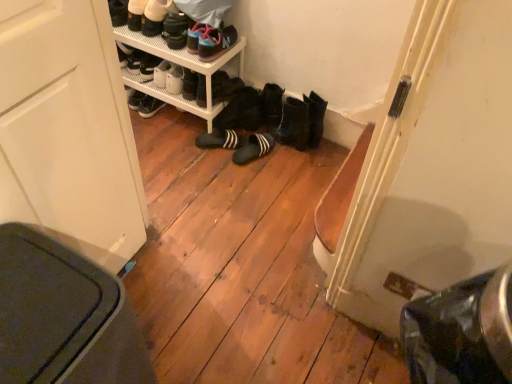
Question: In which direction should I rotate to look at black suede slippers at center, arranged as the 7th footwear when viewed from the top?

Choices:
 (A) left
 (B) right

Answer: (A)

Question: Considering the relative positions of white leather shoes at upper left, which is counted as the seventh footwear, starting from the bottom, and white plastic shelf at upper center in the image provided, is white leather shoes at upper left, which is counted as the seventh footwear, starting from the bottom, behind white plastic shelf at upper center?

Choices:
 (A) yes
 (B) no

Answer: (B)

Question: Is white leather shoes at upper left, which ranks as the first footwear in top-to-bottom order, facing away from white plastic shelf at upper center?

Choices:
 (A) yes
 (B) no

Answer: (B)

Question: From a real-world perspective, is white leather shoes at upper left, which is counted as the seventh footwear, starting from the bottom, located beneath white plastic shelf at upper center?

Choices:
 (A) yes
 (B) no

Answer: (B)

Question: From the image's perspective, is white leather shoes at upper left, which is counted as the seventh footwear, starting from the bottom, under white plastic shelf at upper center?

Choices:
 (A) no
 (B) yes

Answer: (A)

Question: Is white leather shoes at upper left, which ranks as the first footwear in top-to-bottom order, closer to camera compared to white plastic shelf at upper center?

Choices:
 (A) no
 (B) yes

Answer: (B)

Question: Does white leather shoes at upper left, which is counted as the seventh footwear, starting from the bottom, appear on the right side of white plastic shelf at upper center?

Choices:
 (A) no
 (B) yes

Answer: (A)

Question: Is matte black sneakers at upper center, marked as the 5th footwear in a bottom-to-top arrangement, closer to the viewer compared to black rubber boots at center, arranged as the 5th footwear when viewed from the top?

Choices:
 (A) yes
 (B) no

Answer: (A)

Question: Is matte black sneakers at upper center, the 3th footwear from the top, positioned far away from black rubber boots at center, arranged as the 5th footwear when viewed from the top?

Choices:
 (A) yes
 (B) no

Answer: (B)

Question: Is matte black sneakers at upper center, marked as the 5th footwear in a bottom-to-top arrangement, completely or partially outside of black rubber boots at center, arranged as the 5th footwear when viewed from the top?

Choices:
 (A) no
 (B) yes

Answer: (B)

Question: Can you confirm if matte black sneakers at upper center, the 3th footwear from the top, is wider than black rubber boots at center, arranged as the 5th footwear when viewed from the top?

Choices:
 (A) yes
 (B) no

Answer: (A)

Question: From a real-world perspective, does matte black sneakers at upper center, the 3th footwear from the top, sit lower than black rubber boots at center, arranged as the 5th footwear when viewed from the top?

Choices:
 (A) no
 (B) yes

Answer: (A)

Question: Are matte black sneakers at upper center, the 3th footwear from the top, and black rubber boots at center, arranged as the 5th footwear when viewed from the top, beside each other?

Choices:
 (A) yes
 (B) no

Answer: (B)

Question: Is matte black sneakers at upper center, marked as the 5th footwear in a bottom-to-top arrangement, positioned with its back to white plastic shelf at upper center?

Choices:
 (A) yes
 (B) no

Answer: (B)